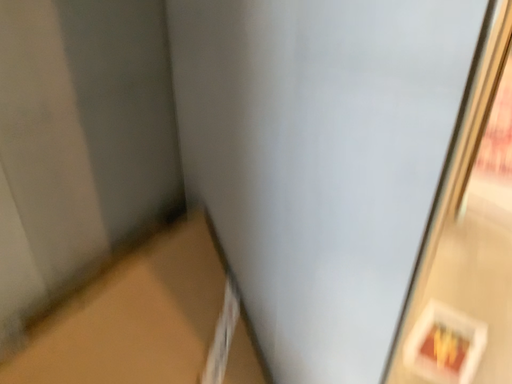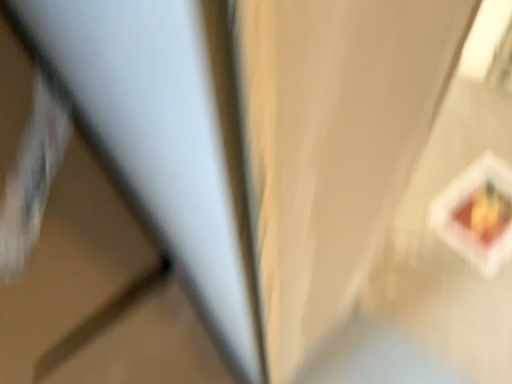
Question: How did the camera likely rotate when shooting the video?

Choices:
 (A) rotated right
 (B) rotated left

Answer: (B)